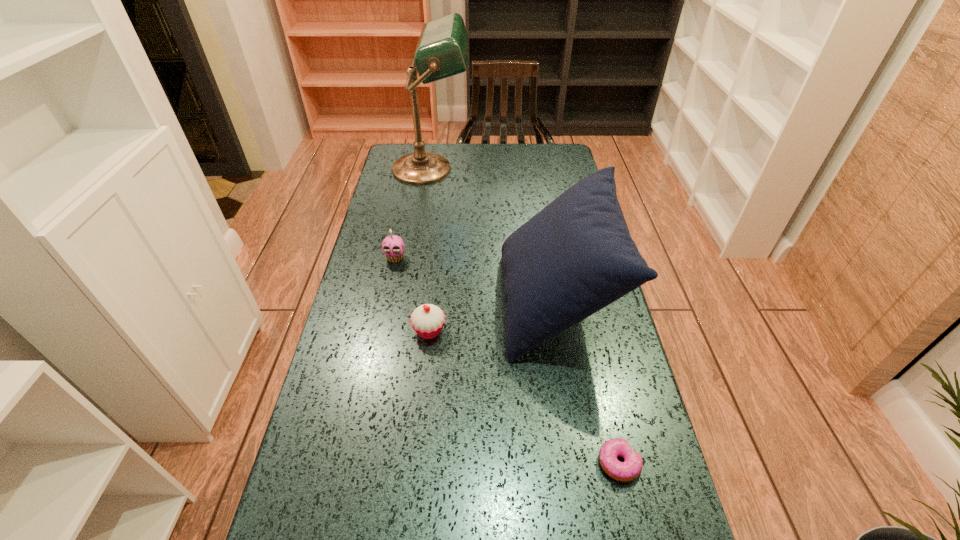
Where is `free location located 0.250m on the facing side of the cushion`? The height and width of the screenshot is (540, 960). free location located 0.250m on the facing side of the cushion is located at coordinates (416, 302).

Locate an element on the screen. vacant space located 0.110m on the facing side of the cushion is located at coordinates (464, 302).

Where is `free region located 0.380m on the facing side of the cushion`? The height and width of the screenshot is (540, 960). free region located 0.380m on the facing side of the cushion is located at coordinates (371, 302).

The height and width of the screenshot is (540, 960). What are the coordinates of `free location located on the face of the third shortest object` in the screenshot? It's located at (377, 344).

Find the location of a particular element. The width and height of the screenshot is (960, 540). vacant region located 0.280m on the front of the second shortest object is located at coordinates (417, 448).

You are a GUI agent. You are given a task and a screenshot of the screen. Output one action in this format:
    pyautogui.click(x=<x>, y=<y>)
    Task: Click on the free space located on the left of the nearest object
    
    Given the screenshot: What is the action you would take?
    pyautogui.click(x=499, y=463)

Where is `object positioned at the far edge`? The height and width of the screenshot is (540, 960). object positioned at the far edge is located at coordinates (442, 49).

At what (x,y) coordinates should I click in order to perform the action: click on table lamp present at the left edge. Please return your answer as a coordinate pair (x, y). Looking at the image, I should click on (442, 49).

Locate an element on the screen. The image size is (960, 540). cupcake that is at the left edge is located at coordinates pos(393,246).

The image size is (960, 540). Identify the location of cushion at the right edge. (573, 258).